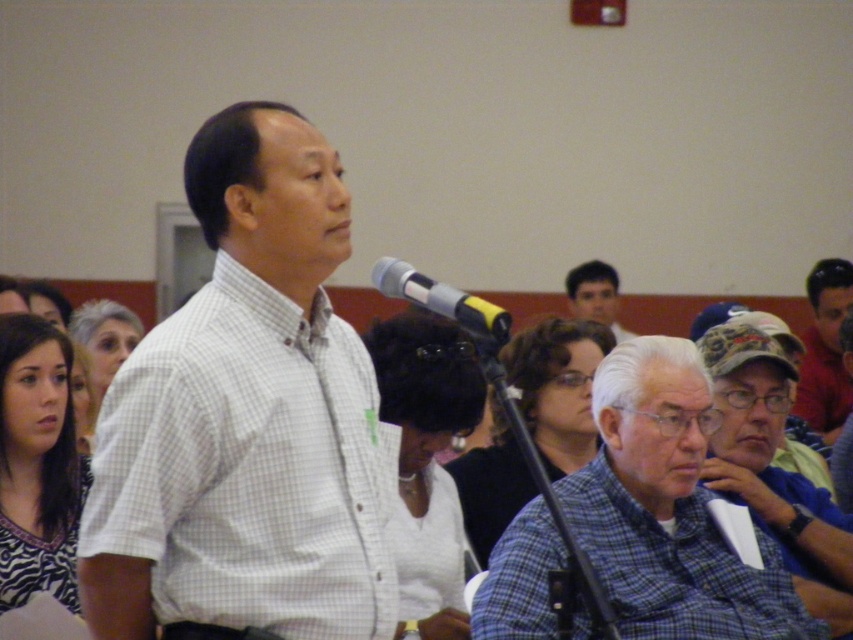
You are a photographer taking a group photo of the scene. You need to ensure both the matte blue shirt at center and the smooth black hair at upper center are clearly visible. Which object should you focus on to ensure both are in frame and properly exposed?

You should focus on the matte blue shirt at center because it is larger in size than the smooth black hair at upper center, making it easier to ensure both are in frame and properly exposed.

You are organizing a photo shoot and need to arrange two shirts for a display. The blue plaid shirt at center and the matte blue shirt at center are available. Based on their sizes, which shirt should you place on the left side of the display to ensure they fit within a 1.2 meter wide shelf?

The blue plaid shirt at center might be wider than matte blue shirt at center, so placing the blue plaid shirt at center on the left side would require ensuring there is enough space, but since the exact width isn

You are a photographer trying to capture a clear photo of both the blue plaid shirt at center and the matte blue shirt at center. Since both are at center, which one will appear larger in the photo?

The blue plaid shirt at center will appear larger in the photo because it is closer to the viewer than the matte blue shirt at center.